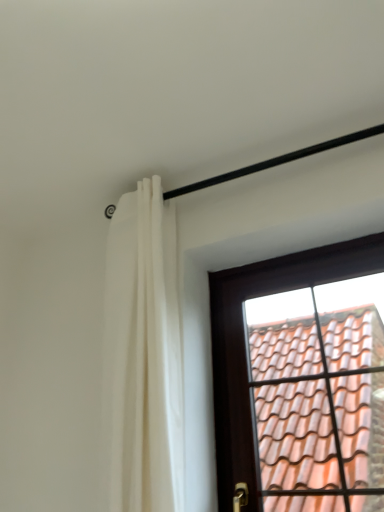
Question: Is white fabric curtain at upper left thinner than brown wooden window at upper right?

Choices:
 (A) yes
 (B) no

Answer: (B)

Question: Is white fabric curtain at upper left outside of brown wooden window at upper right?

Choices:
 (A) no
 (B) yes

Answer: (B)

Question: Does white fabric curtain at upper left appear on the right side of brown wooden window at upper right?

Choices:
 (A) yes
 (B) no

Answer: (B)

Question: From the image's perspective, is white fabric curtain at upper left on top of brown wooden window at upper right?

Choices:
 (A) no
 (B) yes

Answer: (B)

Question: Does white fabric curtain at upper left have a larger size compared to brown wooden window at upper right?

Choices:
 (A) no
 (B) yes

Answer: (B)

Question: Is white fabric curtain at upper left wider than brown wooden window at upper right?

Choices:
 (A) yes
 (B) no

Answer: (A)

Question: From the image's perspective, is brown wooden window at upper right beneath white fabric curtain at upper left?

Choices:
 (A) no
 (B) yes

Answer: (B)

Question: Does brown wooden window at upper right contain white fabric curtain at upper left?

Choices:
 (A) yes
 (B) no

Answer: (B)

Question: Is brown wooden window at upper right outside white fabric curtain at upper left?

Choices:
 (A) no
 (B) yes

Answer: (B)

Question: From the image's perspective, does brown wooden window at upper right appear higher than white fabric curtain at upper left?

Choices:
 (A) yes
 (B) no

Answer: (B)

Question: Considering the relative positions of brown wooden window at upper right and white fabric curtain at upper left in the image provided, is brown wooden window at upper right to the right of white fabric curtain at upper left from the viewer's perspective?

Choices:
 (A) no
 (B) yes

Answer: (B)

Question: Can you confirm if brown wooden window at upper right is bigger than white fabric curtain at upper left?

Choices:
 (A) no
 (B) yes

Answer: (A)

Question: Would you say white fabric curtain at upper left is inside or outside brown wooden window at upper right?

Choices:
 (A) outside
 (B) inside

Answer: (A)